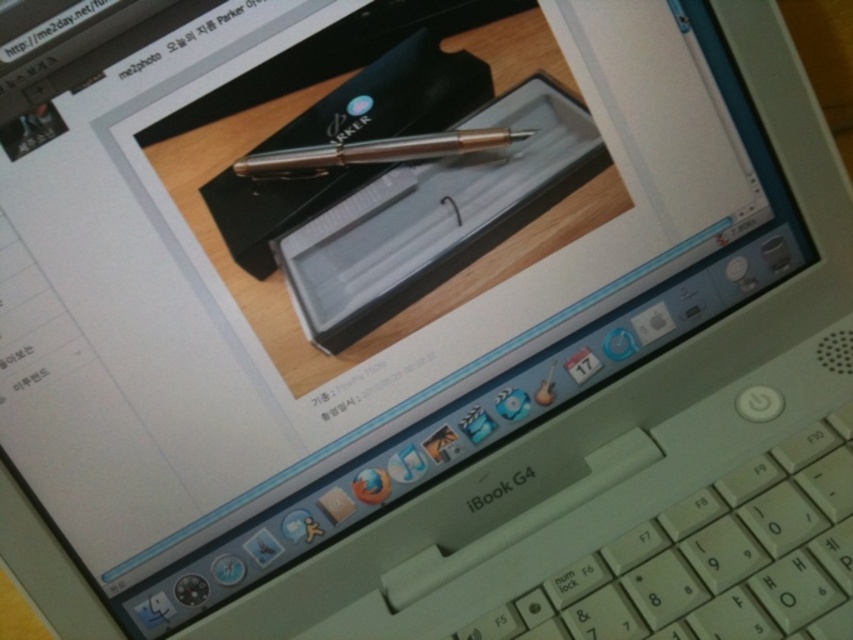
You are looking at the laptop screen showing the webpage. There are two points marked on the screen at coordinates point (764, 488) and point (415, 160). Which of these points is closer to you as you view the screen?

Point (764, 488) is closer to the camera than point (415, 160).

You are designing a layout for a product showcase and need to place the white plastic keyboard at lower right and the gold metallic pen at center on a shelf. If the shelf has limited space, which item should you prioritize placing first to ensure both fit?

The gold metallic pen at center should be placed first since it is smaller in size compared to the white plastic keyboard at lower right, allowing more space for the larger keyboard afterward.